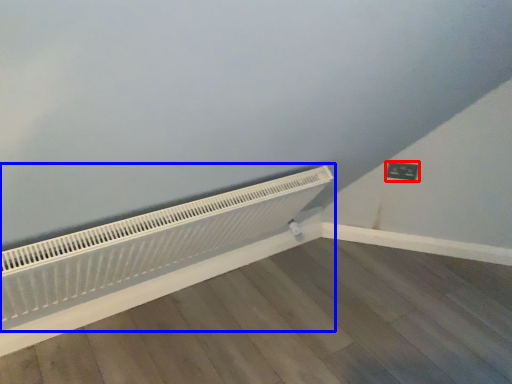
Question: Which point is closer to the camera, electric outlet (highlighted by a red box) or heater (highlighted by a blue box)?

Choices:
 (A) electric outlet
 (B) heater

Answer: (B)